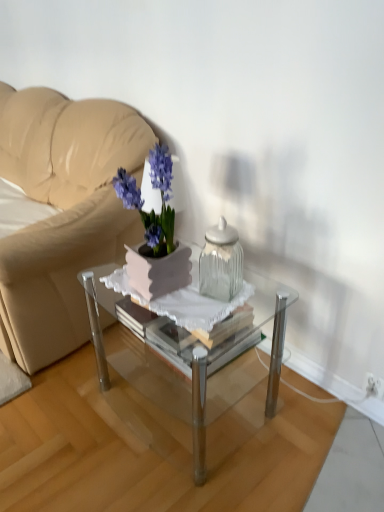
Question: Is clear glass coffee table at center a part of white plastic electric outlet at lower right?

Choices:
 (A) no
 (B) yes

Answer: (A)

Question: Does white plastic electric outlet at lower right have a larger size compared to clear glass coffee table at center?

Choices:
 (A) no
 (B) yes

Answer: (A)

Question: From a real-world perspective, is white plastic electric outlet at lower right on top of clear glass coffee table at center?

Choices:
 (A) no
 (B) yes

Answer: (A)

Question: Does white plastic electric outlet at lower right have a lesser width compared to clear glass coffee table at center?

Choices:
 (A) yes
 (B) no

Answer: (A)

Question: Is clear glass coffee table at center at the back of white plastic electric outlet at lower right?

Choices:
 (A) yes
 (B) no

Answer: (B)

Question: Can you confirm if white plastic electric outlet at lower right is positioned to the right of clear glass coffee table at center?

Choices:
 (A) no
 (B) yes

Answer: (B)

Question: Considering the relative positions of matte purple flower pot at center and clear glass coffee table at center in the image provided, is matte purple flower pot at center to the right of clear glass coffee table at center from the viewer's perspective?

Choices:
 (A) no
 (B) yes

Answer: (A)

Question: From a real-world perspective, is matte purple flower pot at center located beneath clear glass coffee table at center?

Choices:
 (A) yes
 (B) no

Answer: (B)

Question: Can you confirm if matte purple flower pot at center is wider than clear glass coffee table at center?

Choices:
 (A) yes
 (B) no

Answer: (B)

Question: Does matte purple flower pot at center appear on the left side of clear glass coffee table at center?

Choices:
 (A) no
 (B) yes

Answer: (B)

Question: From the image's perspective, is matte purple flower pot at center above clear glass coffee table at center?

Choices:
 (A) yes
 (B) no

Answer: (A)

Question: Does matte purple flower pot at center contain clear glass coffee table at center?

Choices:
 (A) no
 (B) yes

Answer: (A)

Question: Can you confirm if matte purple flower pot at center is wider than clear glass jar at center?

Choices:
 (A) yes
 (B) no

Answer: (A)